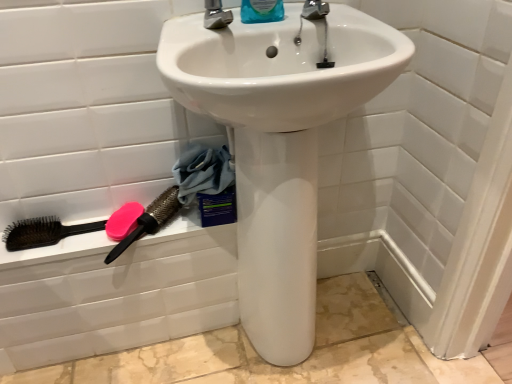
You are a GUI agent. You are given a task and a screenshot of the screen. Output one action in this format:
    pyautogui.click(x=<x>, y=<y>)
    Task: Click on the vacant location below pink rubber brush at lower left, which appears as the 1th brush when viewed from the right (from a real-world perspective)
    The width and height of the screenshot is (512, 384).
    Given the screenshot: What is the action you would take?
    [x=167, y=332]